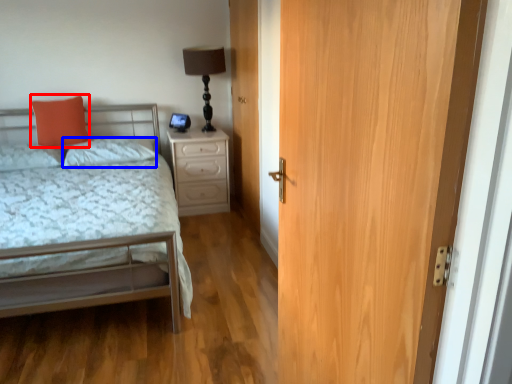
Question: Which of the following is the closest to the observer, pillow (highlighted by a red box) or pillow (highlighted by a blue box)?

Choices:
 (A) pillow
 (B) pillow

Answer: (B)